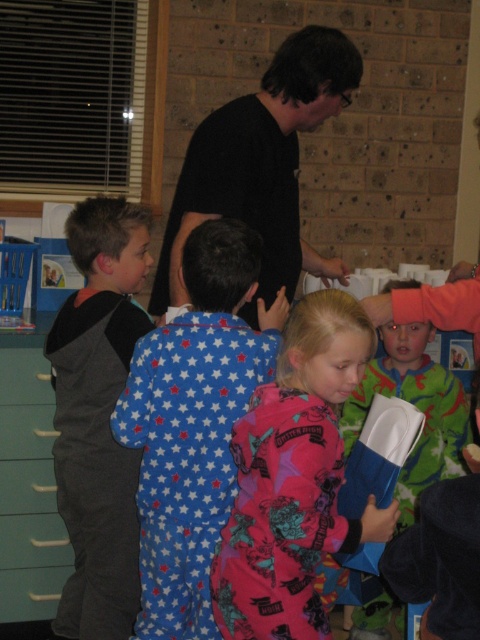
Can you confirm if blue star-patterned pajamas at center-left is thinner than matte blue drawer at lower left?

No, blue star-patterned pajamas at center-left is not thinner than matte blue drawer at lower left.

Is point (228, 500) in front of point (51, 500)?

Yes.

Find the location of a particular element. The image size is (480, 640). blue star-patterned pajamas at center-left is located at coordinates (193, 424).

Who is positioned more to the right, blue fabric book at center or matte green drawer at lower left?

From the viewer's perspective, blue fabric book at center appears more on the right side.

Is point (395, 458) farther from camera compared to point (23, 429)?

No, (395, 458) is in front of (23, 429).

Identify the location of blue fabric book at center. 379,454.

Does teal plastic drawer at lower left come behind matte blue drawer at lower left?

Yes, it is behind matte blue drawer at lower left.

Which is in front, point (69, 554) or point (41, 461)?

Point (41, 461) is more forward.

Identify the location of teal plastic drawer at lower left. This screenshot has width=480, height=640. (34, 541).